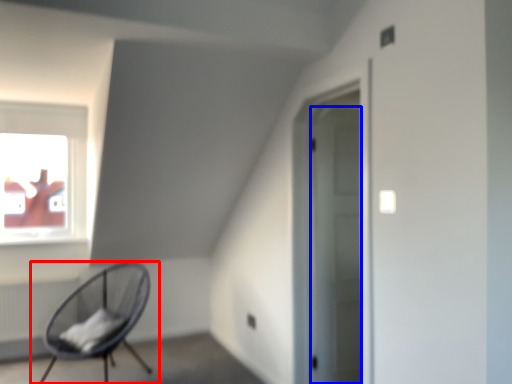
Question: Among these objects, which one is nearest to the camera, chair (highlighted by a red box) or door (highlighted by a blue box)?

Choices:
 (A) chair
 (B) door

Answer: (A)